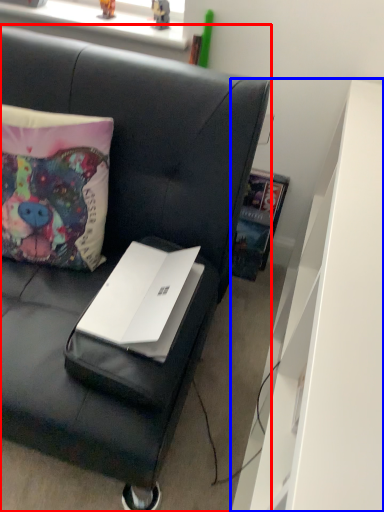
Question: Which object is further to the camera taking this photo, studio couch (highlighted by a red box) or dresser (highlighted by a blue box)?

Choices:
 (A) studio couch
 (B) dresser

Answer: (A)